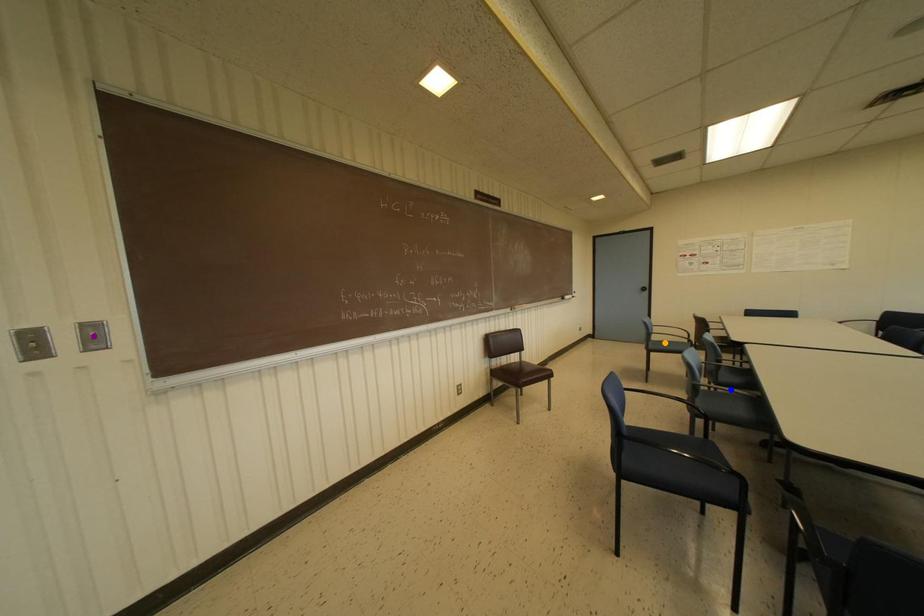
Looking at this image, order these from farthest to nearest:
orange point, purple point, blue point

orange point, blue point, purple point